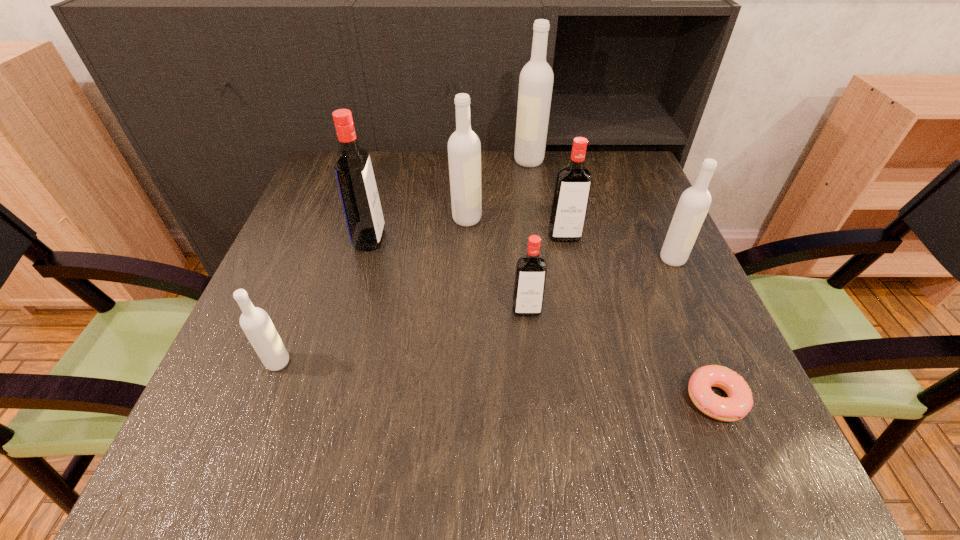
The height and width of the screenshot is (540, 960). I want to click on the nearest red vodka, so (x=531, y=269).

Identify the location of the nearest vodka. (255, 322).

Identify the location of the leftmost object. This screenshot has height=540, width=960. (255, 322).

I want to click on pink doughnut, so click(x=740, y=400).

The image size is (960, 540). Find the location of `the shortest object`. the shortest object is located at coordinates (740, 400).

You are a GUI agent. You are given a task and a screenshot of the screen. Output one action in this format:
    pyautogui.click(x=<x>, y=<y>)
    Task: Click on the blank space located on the left of the farthest white vodka
    Image resolution: width=960 pixels, height=540 pixels.
    Given the screenshot: What is the action you would take?
    pyautogui.click(x=454, y=161)

Image resolution: width=960 pixels, height=540 pixels. Find the location of `vacant space positioned 0.210m on the front and back of the sixth vodka from right to left`. vacant space positioned 0.210m on the front and back of the sixth vodka from right to left is located at coordinates click(476, 239).

This screenshot has height=540, width=960. I want to click on vacant space located on the left of the second white vodka from left to right, so click(x=326, y=219).

Locate an element on the screen. This screenshot has width=960, height=540. free space located on the front of the rightmost white vodka is located at coordinates (705, 332).

In order to click on vacant space situated 0.340m on the front and back of the rightmost red vodka in this screenshot , I will do `click(593, 373)`.